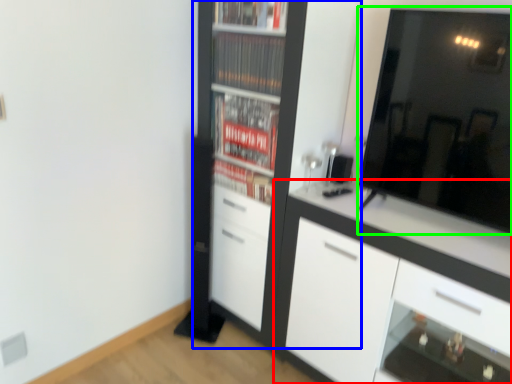
Question: Considering the real-world distances, which object is closest to cabinetry (highlighted by a red box)? cupboard (highlighted by a blue box) or mirror (highlighted by a green box).

Choices:
 (A) cupboard
 (B) mirror

Answer: (B)